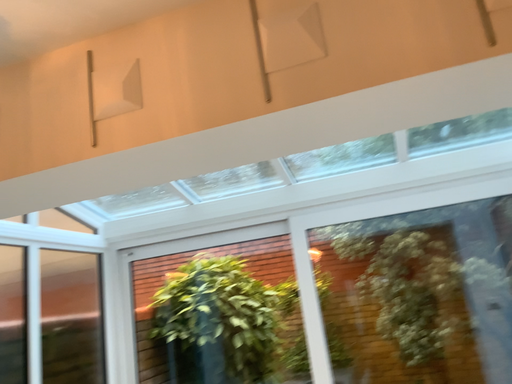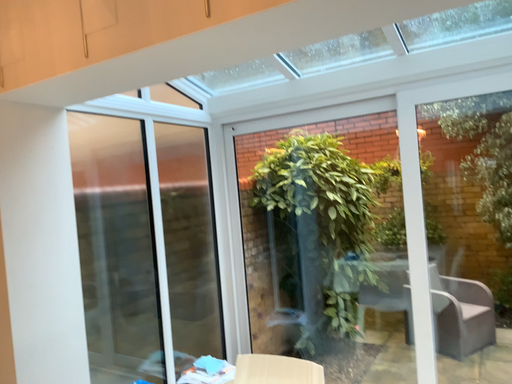
Question: How did the camera likely rotate when shooting the video?

Choices:
 (A) rotated upward
 (B) rotated downward

Answer: (B)